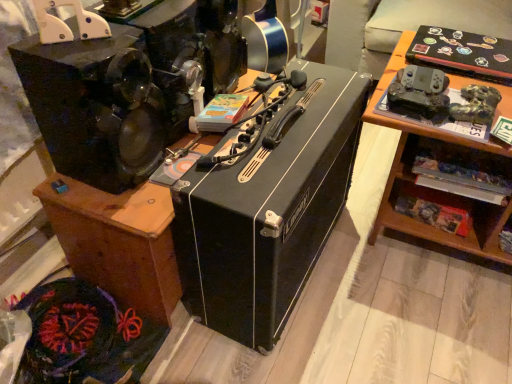
The height and width of the screenshot is (384, 512). Describe the element at coordinates (118, 241) in the screenshot. I see `black matte amplifier at center` at that location.

What is the approximate height of black matte amplifier at center?

43.05 centimeters.

What is the approximate width of black matte amplifier at center?

37.69 centimeters.

This screenshot has width=512, height=384. What are the coordinates of `black matte amplifier at center` in the screenshot? It's located at (118, 241).

Find the location of `black matte amplifier at center`. black matte amplifier at center is located at coordinates pyautogui.click(x=267, y=204).

What do you see at coordinates (267, 204) in the screenshot? Image resolution: width=512 pixels, height=384 pixels. I see `black matte amplifier at center` at bounding box center [267, 204].

Find the location of a particular element. This screenshot has width=512, height=384. black matte amplifier at center is located at coordinates (118, 241).

Looking at this image, is black matte amplifier at center at the right side of black matte amplifier at center?

In fact, black matte amplifier at center is to the left of black matte amplifier at center.

Considering their positions, is black matte amplifier at center located in front of or behind black matte amplifier at center?

In the image, black matte amplifier at center appears behind black matte amplifier at center.

Which is further, (199, 141) or (273, 191)?

The point (199, 141) is behind.

From the image's perspective, does black matte amplifier at center appear higher than black matte amplifier at center?

Yes.

From a real-world perspective, is black matte amplifier at center positioned above or below black matte amplifier at center?

In terms of real-world spatial position, black matte amplifier at center is below black matte amplifier at center.

Does black matte amplifier at center have a lesser width compared to black matte amplifier at center?

Incorrect, the width of black matte amplifier at center is not less than that of black matte amplifier at center.

From the picture: In terms of height, does black matte amplifier at center look taller or shorter compared to black matte amplifier at center?

Considering their sizes, black matte amplifier at center has less height than black matte amplifier at center.

In terms of size, does black matte amplifier at center appear bigger or smaller than black matte amplifier at center?

Considering their sizes, black matte amplifier at center takes up more space than black matte amplifier at center.

In the scene shown: Would you say black matte amplifier at center contains black matte amplifier at center?

No, black matte amplifier at center is located outside of black matte amplifier at center.

Looking at this image, is there a large distance between black matte amplifier at center and black matte amplifier at center?

Actually, black matte amplifier at center and black matte amplifier at center are a little close together.

Is black matte amplifier at center looking in the opposite direction of black matte amplifier at center?

Correct, black matte amplifier at center is looking away from black matte amplifier at center.

How different are the orientations of black matte amplifier at center and black matte amplifier at center in degrees?

The angle between the facing direction of black matte amplifier at center and the facing direction of black matte amplifier at center is 1.24 degrees.

Where is `furniture above the black matte amplifier at center (from the image's perspective)`? The image size is (512, 384). furniture above the black matte amplifier at center (from the image's perspective) is located at coordinates (118, 241).

Is black matte amplifier at center to the left or to the right of black matte amplifier at center in the image?

black matte amplifier at center is to the right of black matte amplifier at center.

From the picture: Considering their positions, is black matte amplifier at center located in front of or behind black matte amplifier at center?

Clearly, black matte amplifier at center is in front of black matte amplifier at center.

Which point is more forward, (316, 82) or (142, 198)?

The point (142, 198) is more forward.

From the image's perspective, would you say black matte amplifier at center is shown under black matte amplifier at center?

Yes.

From a real-world perspective, who is located higher, black matte amplifier at center or black matte amplifier at center?

black matte amplifier at center.

Between black matte amplifier at center and black matte amplifier at center, which one has larger width?

Wider between the two is black matte amplifier at center.

Can you confirm if black matte amplifier at center is shorter than black matte amplifier at center?

In fact, black matte amplifier at center may be taller than black matte amplifier at center.

Is black matte amplifier at center bigger than black matte amplifier at center?

Incorrect, black matte amplifier at center is not larger than black matte amplifier at center.

Is black matte amplifier at center inside or outside of black matte amplifier at center?

black matte amplifier at center is spatially situated outside black matte amplifier at center.

Are black matte amplifier at center and black matte amplifier at center making contact?

There is a gap between black matte amplifier at center and black matte amplifier at center.

Is black matte amplifier at center at the back of black matte amplifier at center?

Yes.

Can you tell me how much black matte amplifier at center and black matte amplifier at center differ in facing direction?

1.24 degrees separate the facing orientations of black matte amplifier at center and black matte amplifier at center.

What are the coordinates of `furniture on the left of black matte amplifier at center` in the screenshot? It's located at (118, 241).

I want to click on box that appears in front of the black matte amplifier at center, so click(267, 204).

Locate an element on the screen. box located above the black matte amplifier at center (from a real-world perspective) is located at coordinates (267, 204).